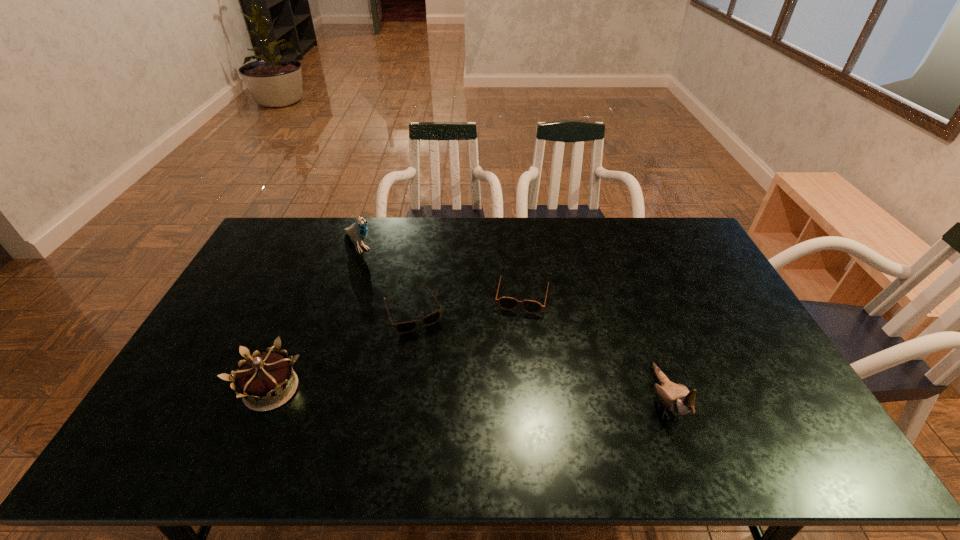
Locate an element on the screen. vacant space on the desktop that is between the third tallest object and the nearer bird and is positioned on the front-facing side of the right sunglasses is located at coordinates (503, 396).

Image resolution: width=960 pixels, height=540 pixels. In order to click on vacant spot on the desktop that is between the third tallest object and the nearer bird and is positioned at the face of the farther bird in this screenshot , I will do `click(498, 395)`.

Locate an element on the screen. The image size is (960, 540). free space on the desktop that is between the crown and the rightmost object and is positioned on the lenses of the shortest object is located at coordinates (455, 394).